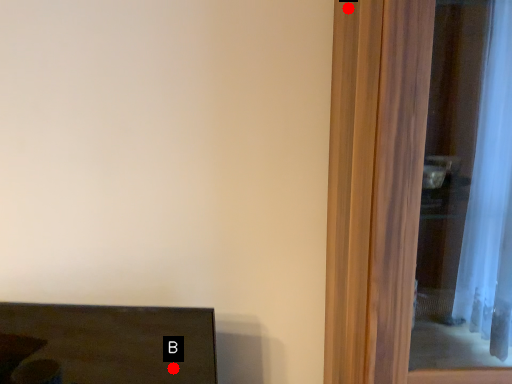
Question: Two points are circled on the image, labeled by A and B beside each circle. Which of the following is the closest to the observer?

Choices:
 (A) A is closer
 (B) B is closer

Answer: (A)